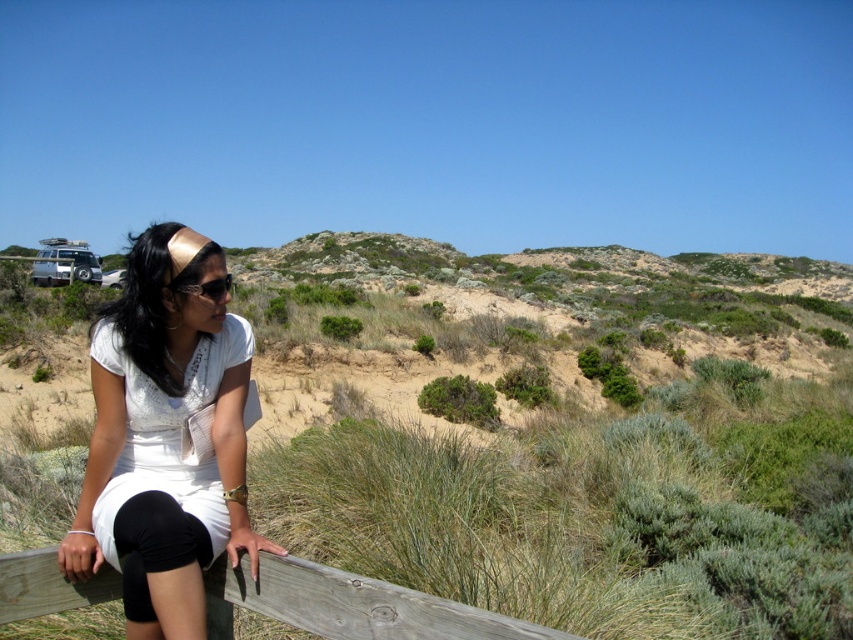
Question: Among these points, which one is nearest to the camera?

Choices:
 (A) (39, 596)
 (B) (103, 496)

Answer: (A)

Question: Is white matte dress at center thinner than wooden at lower left?

Choices:
 (A) yes
 (B) no

Answer: (A)

Question: From the image, what is the correct spatial relationship of white matte dress at center in relation to wooden at lower left?

Choices:
 (A) left
 (B) right

Answer: (A)

Question: Which of the following is the farthest from the observer?

Choices:
 (A) white matte dress at center
 (B) wooden at lower left

Answer: (A)

Question: Does white matte dress at center have a larger size compared to wooden at lower left?

Choices:
 (A) yes
 (B) no

Answer: (A)

Question: Which of the following is the farthest from the observer?

Choices:
 (A) white matte dress at center
 (B) wooden at lower left

Answer: (A)